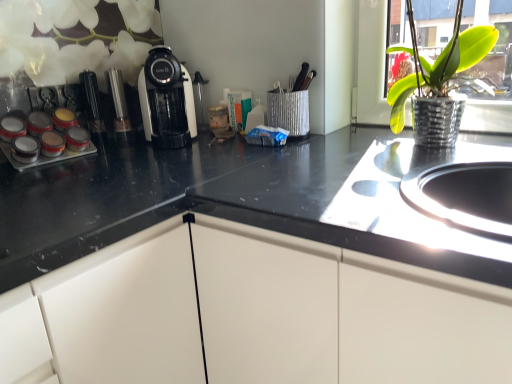
Question: Is white glossy coffee machine at center wider or thinner than green metallic pot at upper right?

Choices:
 (A) thin
 (B) wide

Answer: (B)

Question: From the image's perspective, relative to green metallic pot at upper right, is white glossy coffee machine at center above or below?

Choices:
 (A) below
 (B) above

Answer: (B)

Question: Which object is positioned closest to the white glossy coffee machine at center?

Choices:
 (A) green metallic pot at upper right
 (B) metallic silver spice rack at left

Answer: (B)

Question: Based on their relative distances, which object is nearer to the metallic silver spice rack at left?

Choices:
 (A) white glossy coffee machine at center
 (B) green metallic pot at upper right

Answer: (A)